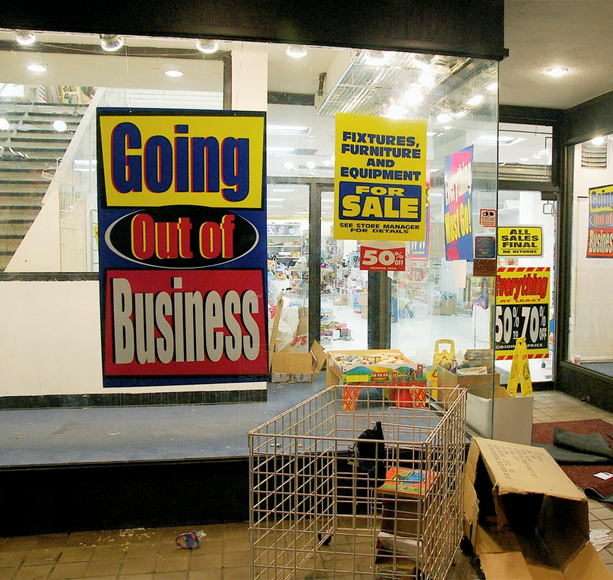
The image size is (613, 580). Identify the location of stairs. (13, 215).